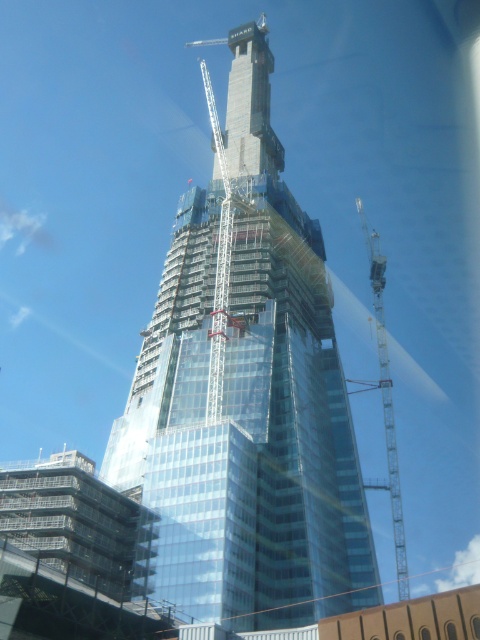
Which of these two, transparent glass tower at center or metallic gray crane at right, stands shorter?

transparent glass tower at center

Does point (266, 355) lie behind point (395, 440)?

No, (266, 355) is in front of (395, 440).

The width and height of the screenshot is (480, 640). What do you see at coordinates (243, 397) in the screenshot? I see `transparent glass tower at center` at bounding box center [243, 397].

Identify the location of transparent glass tower at center. The image size is (480, 640). (243, 397).